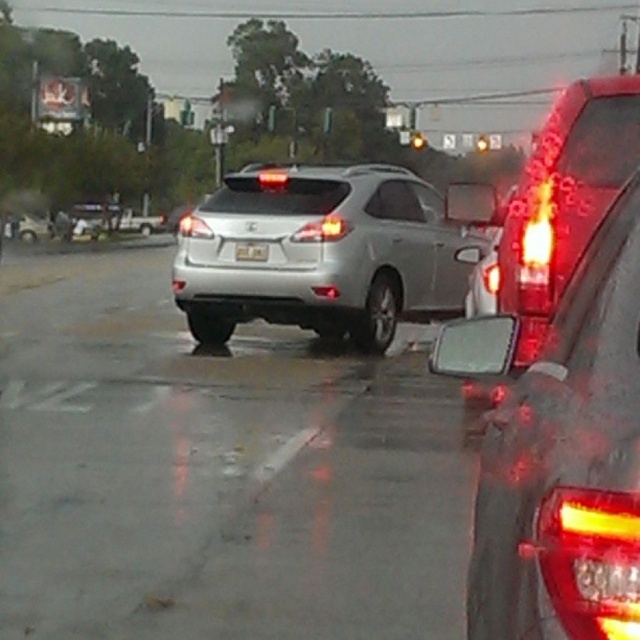
Question: In this image, where is glassy red traffic light at upper center located relative to transparent glass traffic light at upper center?

Choices:
 (A) left
 (B) right

Answer: (A)

Question: Which point is closer to the camera?

Choices:
 (A) (241, 248)
 (B) (412, 134)
 (C) (561, 547)

Answer: (C)

Question: Considering the real-world distances, which object is closest to the satin silver suv at center?

Choices:
 (A) black plastic license plate at center
 (B) glassy red traffic light at upper center

Answer: (A)

Question: Is black plastic license plate at center to the left of transparent glass traffic light at upper center from the viewer's perspective?

Choices:
 (A) no
 (B) yes

Answer: (B)

Question: Considering the relative positions of satin silver suv at center and glassy red traffic light at upper center in the image provided, where is satin silver suv at center located with respect to glassy red traffic light at upper center?

Choices:
 (A) below
 (B) above

Answer: (A)

Question: Which of the following is the closest to the observer?

Choices:
 (A) (264, 250)
 (B) (632, 278)
 (C) (477, 140)

Answer: (B)